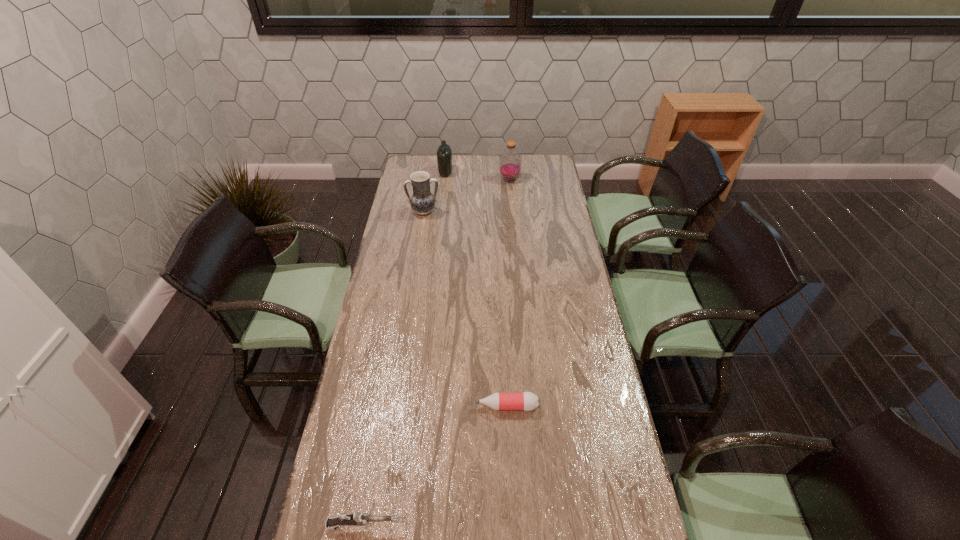
The height and width of the screenshot is (540, 960). In order to click on vacant region between the pottery and the fourth farthest object in this screenshot , I will do `click(466, 309)`.

Locate an element on the screen. vacant space that is in between the leftmost bottle and the shortest bottle is located at coordinates (476, 289).

The height and width of the screenshot is (540, 960). What are the coordinates of `free space between the nearest object and the third nearest object` in the screenshot? It's located at (394, 369).

Image resolution: width=960 pixels, height=540 pixels. Find the location of `vacant area between the nearest object and the pottery`. vacant area between the nearest object and the pottery is located at coordinates 394,369.

Where is `vacant area that lies between the leftmost bottle and the shortest object`? vacant area that lies between the leftmost bottle and the shortest object is located at coordinates (476, 289).

Locate an element on the screen. This screenshot has width=960, height=540. object that is the closest to the nearest object is located at coordinates (528, 401).

Locate an element on the screen. the closest object to the pottery is located at coordinates (444, 153).

Identify which bottle is the second closest to the gun. Please provide its 2D coordinates. Your answer should be formatted as a tuple, i.e. [(x, y)], where the tuple contains the x and y coordinates of a point satisfying the conditions above.

[(510, 164)]

Locate an element on the screen. Image resolution: width=960 pixels, height=540 pixels. bottle that stands as the third closest to the nearest object is located at coordinates (444, 153).

Where is `free point that satisfies the following two spatial constraints: 1. on the front side of the leftmost bottle; 2. aimed along the barrel of the fourth tallest object`? The width and height of the screenshot is (960, 540). free point that satisfies the following two spatial constraints: 1. on the front side of the leftmost bottle; 2. aimed along the barrel of the fourth tallest object is located at coordinates (407, 526).